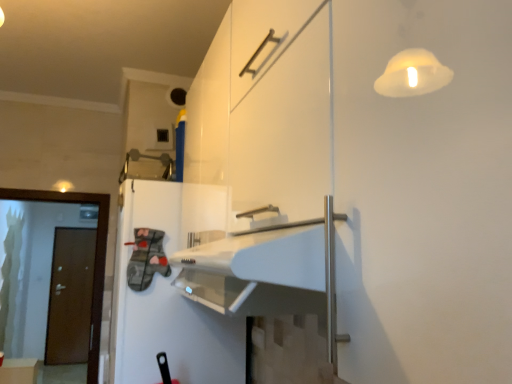
Question: Is brown matte door at left bigger than white glossy refrigerator at center?

Choices:
 (A) no
 (B) yes

Answer: (A)

Question: Does brown matte door at left appear on the right side of white glossy refrigerator at center?

Choices:
 (A) yes
 (B) no

Answer: (B)

Question: Considering the relative sizes of brown matte door at left and white glossy refrigerator at center in the image provided, is brown matte door at left thinner than white glossy refrigerator at center?

Choices:
 (A) yes
 (B) no

Answer: (A)

Question: Does brown matte door at left appear on the left side of white glossy refrigerator at center?

Choices:
 (A) yes
 (B) no

Answer: (A)

Question: Does brown matte door at left have a lesser height compared to white glossy refrigerator at center?

Choices:
 (A) yes
 (B) no

Answer: (B)

Question: From a real-world perspective, is brown matte door at left above or below white glossy refrigerator at center?

Choices:
 (A) above
 (B) below

Answer: (B)

Question: Is brown matte door at left taller or shorter than white glossy refrigerator at center?

Choices:
 (A) short
 (B) tall

Answer: (B)

Question: Based on their positions, is brown matte door at left located to the left or right of white glossy refrigerator at center?

Choices:
 (A) left
 (B) right

Answer: (A)

Question: Is brown matte door at left wider or thinner than white glossy refrigerator at center?

Choices:
 (A) wide
 (B) thin

Answer: (B)

Question: Based on their positions, is matte white cabinet at lower left located to the left or right of brown matte door at left?

Choices:
 (A) right
 (B) left

Answer: (B)

Question: From a real-world perspective, is matte white cabinet at lower left positioned above or below brown matte door at left?

Choices:
 (A) above
 (B) below

Answer: (B)

Question: From the image's perspective, is matte white cabinet at lower left located above or below brown matte door at left?

Choices:
 (A) below
 (B) above

Answer: (A)

Question: Choose the correct answer: Is matte white cabinet at lower left inside brown matte door at left or outside it?

Choices:
 (A) outside
 (B) inside

Answer: (A)

Question: Do you think brown matte door at left is within brown matte door at left, or outside of it?

Choices:
 (A) outside
 (B) inside

Answer: (A)

Question: Looking at their shapes, would you say brown matte door at left is wider or thinner than brown matte door at left?

Choices:
 (A) wide
 (B) thin

Answer: (A)